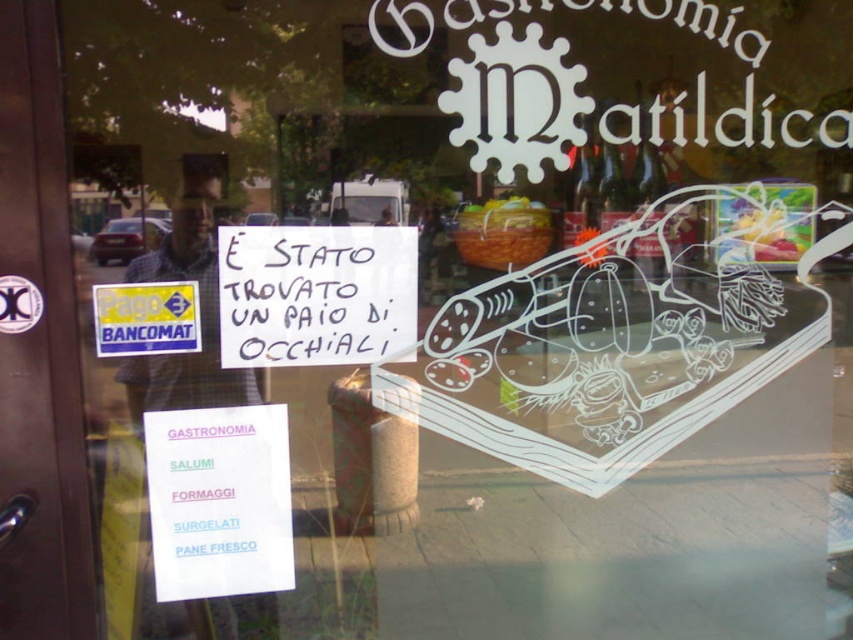
Can you confirm if brown wooden door at left is positioned to the right of white handwritten sign at center?

Incorrect, brown wooden door at left is not on the right side of white handwritten sign at center.

Between point (32, 381) and point (373, 305), which one is positioned in front?

Point (32, 381)

Locate an element on the screen. The width and height of the screenshot is (853, 640). brown wooden door at left is located at coordinates (39, 346).

Between brown wooden door at left and white paper sign at lower left, which one appears on the left side from the viewer's perspective?

Positioned to the left is brown wooden door at left.

Which is in front, point (7, 17) or point (257, 529)?

Positioned in front is point (7, 17).

This screenshot has width=853, height=640. Identify the location of brown wooden door at left. (39, 346).

Does white handwritten sign at center appear under white paper sign at lower left?

No, white handwritten sign at center is not below white paper sign at lower left.

At what (x,y) coordinates should I click in order to perform the action: click on white handwritten sign at center. Please return your answer as a coordinate pair (x, y). The height and width of the screenshot is (640, 853). Looking at the image, I should click on (316, 296).

You are a GUI agent. You are given a task and a screenshot of the screen. Output one action in this format:
    pyautogui.click(x=<x>, y=<y>)
    Task: Click on the white handwritten sign at center
    
    Given the screenshot: What is the action you would take?
    pyautogui.click(x=316, y=296)